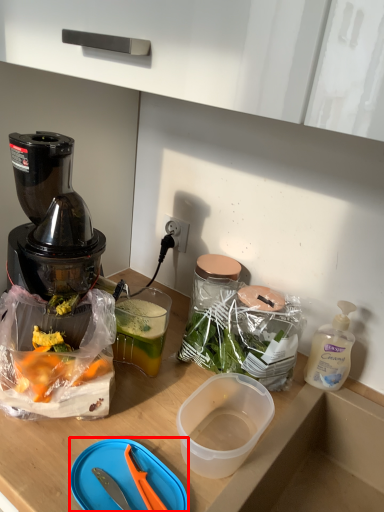
Question: Observing the image, what is the correct spatial positioning of cutting board (annotated by the red box) in reference to bottle?

Choices:
 (A) right
 (B) left

Answer: (B)